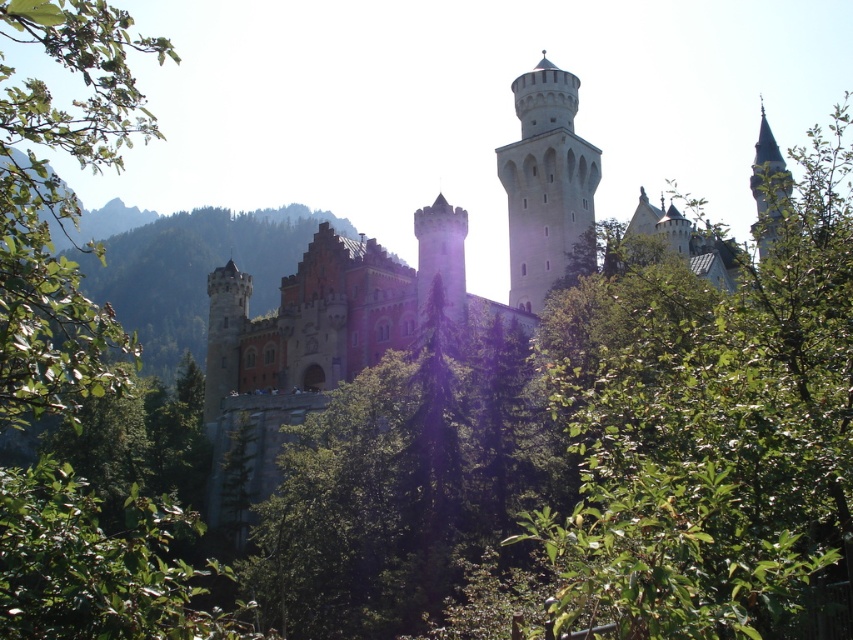
Question: Which of these objects is positioned closest to the green leafy tree at left?

Choices:
 (A) smooth stone tower at center
 (B) white stone tower at upper right

Answer: (A)

Question: Which of the following is the closest to the observer?

Choices:
 (A) (524, 259)
 (B) (595, 540)
 (C) (212, 284)

Answer: (B)

Question: Estimate the real-world distances between objects in this image. Which object is farther from the green leafy tree at center?

Choices:
 (A) green leafy tree at left
 (B) red brick castle at center

Answer: (A)

Question: Is the position of red brick castle at center more distant than that of reddish-brown stone tower at center-left?

Choices:
 (A) yes
 (B) no

Answer: (B)

Question: Considering the relative positions of white stone tower at upper center and reddish-brown stone tower at center-left in the image provided, where is white stone tower at upper center located with respect to reddish-brown stone tower at center-left?

Choices:
 (A) below
 (B) above

Answer: (B)

Question: Considering the relative positions of white stone tower at upper center and reddish-brown stone tower at center-left in the image provided, where is white stone tower at upper center located with respect to reddish-brown stone tower at center-left?

Choices:
 (A) above
 (B) below

Answer: (A)